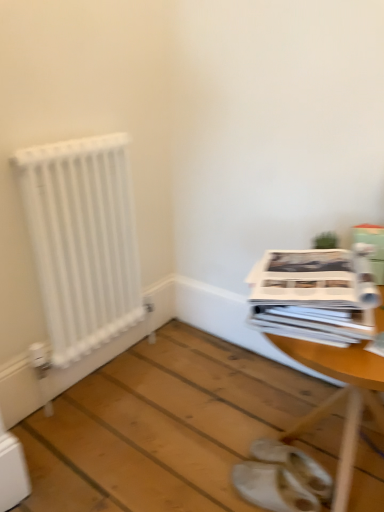
Question: Choose the correct answer: Is white leather sandals at lower center inside white glossy magazine at right or outside it?

Choices:
 (A) outside
 (B) inside

Answer: (A)

Question: Is white leather sandals at lower center to the left or to the right of white glossy magazine at right in the image?

Choices:
 (A) left
 (B) right

Answer: (A)

Question: Which object is the closest to the wooden table at center?

Choices:
 (A) white leather sandals at lower center
 (B) green cardboard box at upper right
 (C) white glossy magazine at right
 (D) white matte radiator at left

Answer: (A)

Question: Which is nearer to the wooden table at center?

Choices:
 (A) white matte radiator at left
 (B) green cardboard box at upper right
 (C) white glossy magazine at right
 (D) white leather sandals at lower center

Answer: (D)